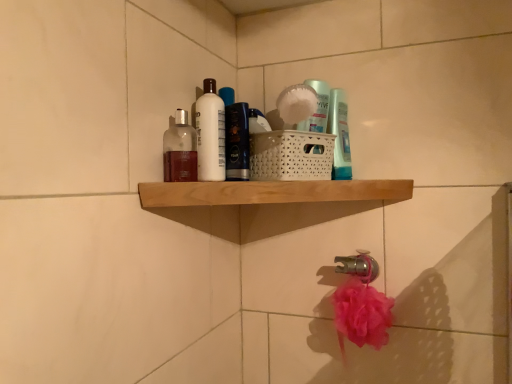
Question: From a real-world perspective, is translucent glass bottle at upper center, the 3th toiletry from the right, over translucent plastic bottle at upper center, which is the first toiletry from back to front?

Choices:
 (A) yes
 (B) no

Answer: (B)

Question: Does translucent glass bottle at upper center, the 3th toiletry from the right, have a lesser height compared to translucent plastic bottle at upper center, placed as the first toiletry when sorted from right to left?

Choices:
 (A) yes
 (B) no

Answer: (A)

Question: Does translucent glass bottle at upper center, the 3th toiletry from the right, have a smaller size compared to translucent plastic bottle at upper center, the 3th toiletry when ordered from front to back?

Choices:
 (A) yes
 (B) no

Answer: (B)

Question: Considering the relative sizes of translucent glass bottle at upper center, the first toiletry in the front-to-back sequence, and translucent plastic bottle at upper center, which is the first toiletry from back to front, in the image provided, is translucent glass bottle at upper center, the first toiletry in the front-to-back sequence, thinner than translucent plastic bottle at upper center, which is the first toiletry from back to front,?

Choices:
 (A) yes
 (B) no

Answer: (B)

Question: Is translucent plastic bottle at upper center, which is the first toiletry from back to front, a part of translucent glass bottle at upper center, the 3th toiletry from the right?

Choices:
 (A) yes
 (B) no

Answer: (B)

Question: From the image's perspective, relative to shiny black bottle at upper center, the 2th toiletry viewed from the right, is translucent glass bottle at upper center, which appears as the 1th toiletry when viewed from the left, above or below?

Choices:
 (A) above
 (B) below

Answer: (B)

Question: Is translucent glass bottle at upper center, which appears as the 1th toiletry when viewed from the left, in front of or behind shiny black bottle at upper center, the second toiletry in the back-to-front sequence, in the image?

Choices:
 (A) behind
 (B) front

Answer: (B)

Question: Considering the positions of translucent glass bottle at upper center, the first toiletry in the front-to-back sequence, and shiny black bottle at upper center, which is the second toiletry in front-to-back order, in the image, is translucent glass bottle at upper center, the first toiletry in the front-to-back sequence, taller or shorter than shiny black bottle at upper center, which is the second toiletry in front-to-back order,?

Choices:
 (A) tall
 (B) short

Answer: (B)

Question: Is translucent glass bottle at upper center, which appears as the 1th toiletry when viewed from the left, to the left or to the right of shiny black bottle at upper center, which is the 2th toiletry in left-to-right order, in the image?

Choices:
 (A) right
 (B) left

Answer: (B)

Question: From the image's perspective, is white glossy bottle at upper center above or below wooden shelf at upper center?

Choices:
 (A) above
 (B) below

Answer: (A)

Question: Considering the positions of point (208, 173) and point (202, 198), is point (208, 173) closer or farther from the camera than point (202, 198)?

Choices:
 (A) farther
 (B) closer

Answer: (A)

Question: Looking at the image, does white glossy bottle at upper center seem bigger or smaller compared to wooden shelf at upper center?

Choices:
 (A) big
 (B) small

Answer: (B)

Question: Is white glossy bottle at upper center taller or shorter than wooden shelf at upper center?

Choices:
 (A) short
 (B) tall

Answer: (B)

Question: Is point (169, 162) closer or farther from the camera than point (349, 269)?

Choices:
 (A) closer
 (B) farther

Answer: (A)

Question: Looking at their shapes, would you say translucent glass bottle at upper center, which is counted as the third toiletry, starting from the back, is wider or thinner than silver metallic tap at lower center?

Choices:
 (A) thin
 (B) wide

Answer: (A)